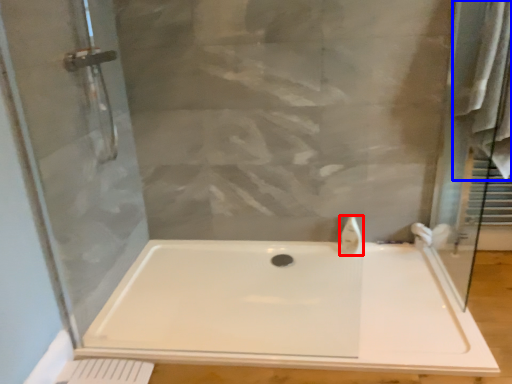
Question: Which object is further to the camera taking this photo, faucet (highlighted by a red box) or bath towel (highlighted by a blue box)?

Choices:
 (A) faucet
 (B) bath towel

Answer: (A)